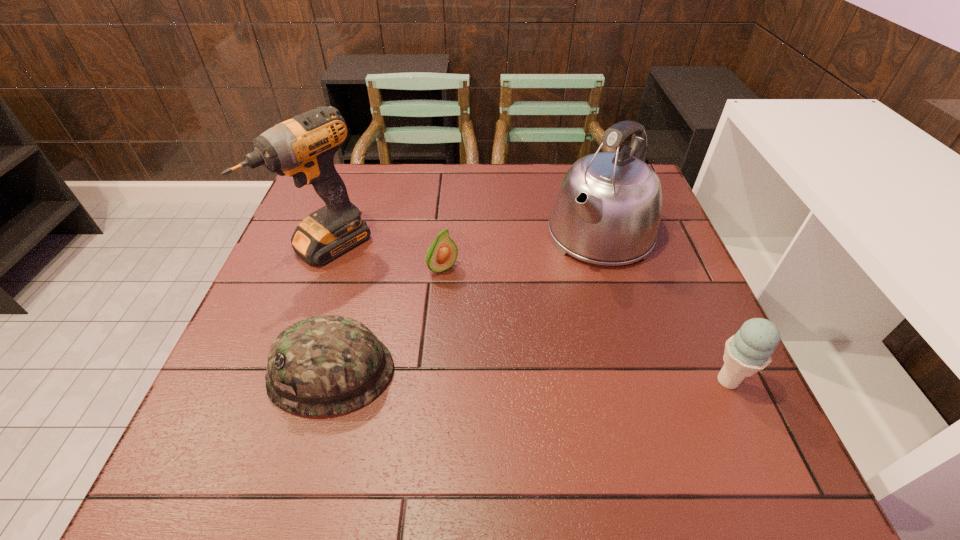
Find the location of a particular element. vacant area that lies between the headwear and the drill is located at coordinates (329, 309).

Where is `free space between the drill and the kettle`? free space between the drill and the kettle is located at coordinates pos(464,241).

I want to click on the third closest object to the kettle, so click(326, 365).

Select which object appears as the fourth closest to the headwear. Please provide its 2D coordinates. Your answer should be formatted as a tuple, i.e. [(x, y)], where the tuple contains the x and y coordinates of a point satisfying the conditions above.

[(748, 351)]

This screenshot has width=960, height=540. In order to click on vacant area that satisfies the following two spatial constraints: 1. on the back side of the kettle; 2. on the left side of the drill in this screenshot , I will do `click(332, 235)`.

I want to click on free space that satisfies the following two spatial constraints: 1. on the front side of the third object from left to right; 2. on the right side of the drill, so click(319, 269).